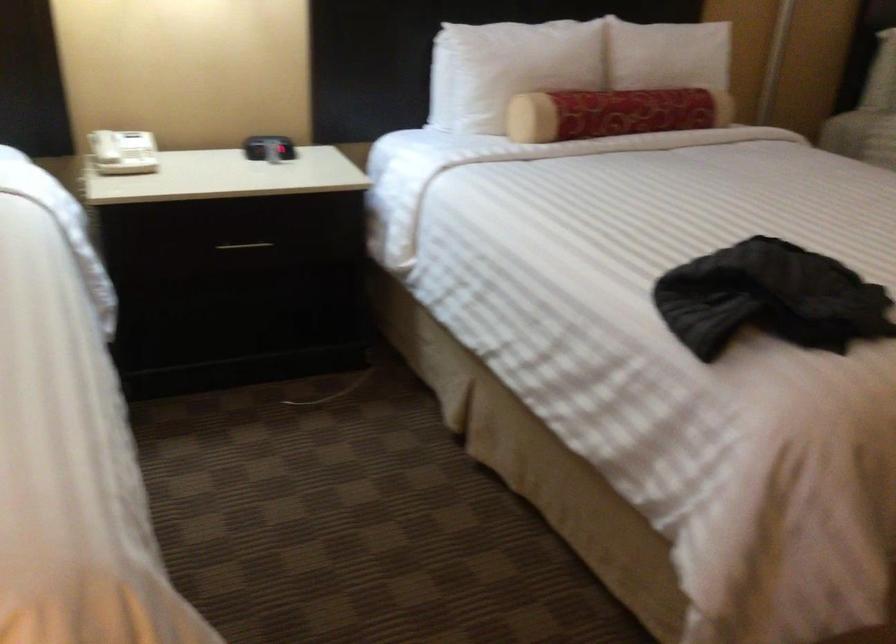
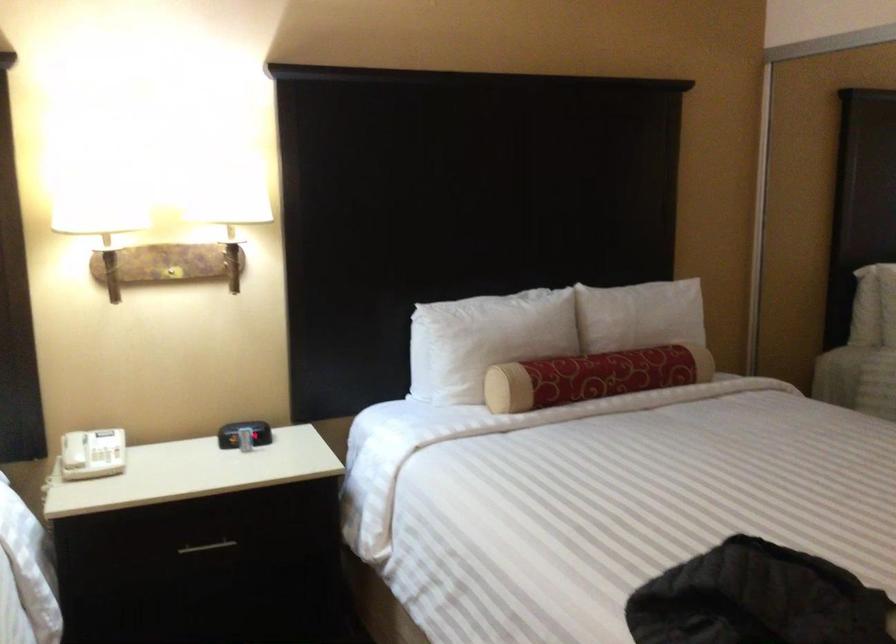
Locate, in the second image, the point that corresponds to point 245,247 in the first image.

(207, 547)